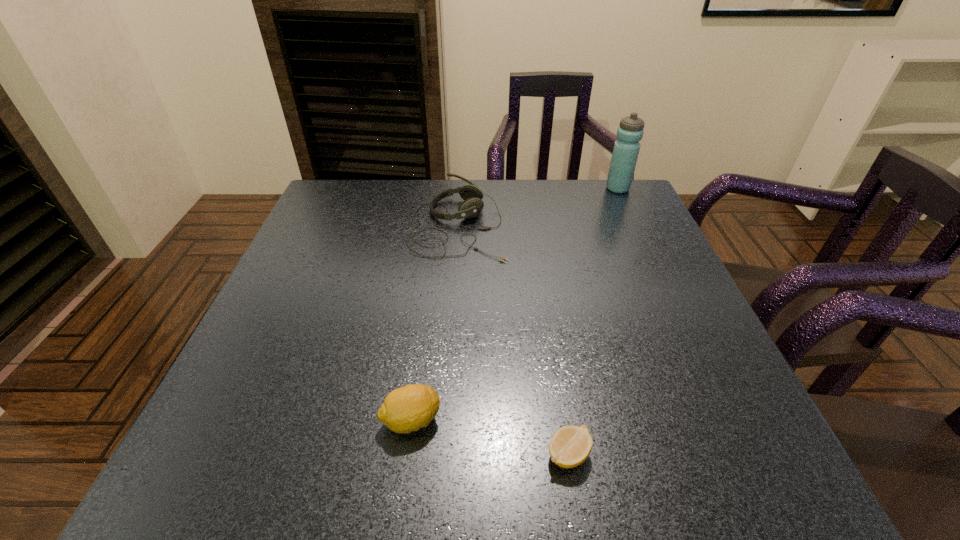
The width and height of the screenshot is (960, 540). I want to click on free space between the water bottle and the second farthest object, so click(x=538, y=207).

Find the location of a particular element. The image size is (960, 540). free spot between the third nearest object and the farthest object is located at coordinates (538, 207).

The width and height of the screenshot is (960, 540). I want to click on free space between the taller lemon and the third nearest object, so click(x=435, y=323).

Locate an element on the screen. The image size is (960, 540). empty location between the shortest object and the tallest object is located at coordinates (593, 321).

Image resolution: width=960 pixels, height=540 pixels. What are the coordinates of `vacant region between the right lemon and the taller lemon` in the screenshot? It's located at (490, 437).

This screenshot has width=960, height=540. I want to click on free space between the third nearest object and the taller lemon, so click(435, 323).

The height and width of the screenshot is (540, 960). In order to click on free space between the farthest object and the right lemon in this screenshot , I will do `click(593, 321)`.

Locate an element on the screen. This screenshot has width=960, height=540. free area in between the second farthest object and the left lemon is located at coordinates (435, 323).

Image resolution: width=960 pixels, height=540 pixels. What are the coordinates of `vacant area between the right lemon and the water bottle` in the screenshot? It's located at (593, 321).

Locate an element on the screen. the closest object to the taller lemon is located at coordinates (570, 446).